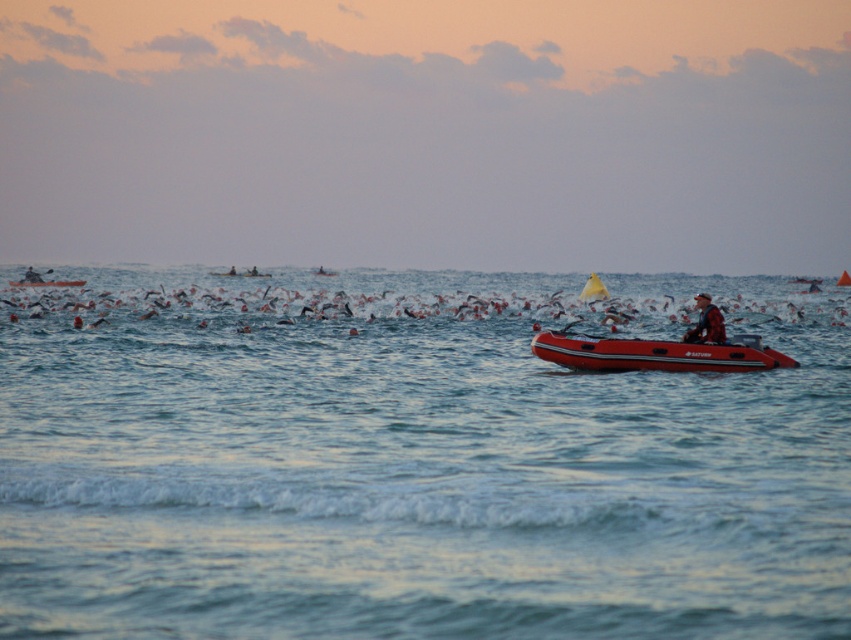
Question: Which of the following is the farthest from the observer?

Choices:
 (A) (38, 282)
 (B) (714, 308)
 (C) (427, 536)
 (D) (632, 340)

Answer: (A)

Question: Which point is closer to the camera?

Choices:
 (A) (23, 284)
 (B) (671, 628)
 (C) (572, 337)
 (D) (695, 305)

Answer: (B)

Question: Does blue water at center appear on the left side of rubberized red inflatable boat at right?

Choices:
 (A) yes
 (B) no

Answer: (A)

Question: Is blue water at center below rubber boat at left?

Choices:
 (A) yes
 (B) no

Answer: (A)

Question: Which object is closer to the camera taking this photo?

Choices:
 (A) rubberized red inflatable boat at right
 (B) blue water at center
 (C) rubber boat at left

Answer: (B)

Question: Observing the image, what is the correct spatial positioning of rubberized red inflatable boat at right in reference to rubber boat at left?

Choices:
 (A) right
 (B) left

Answer: (A)